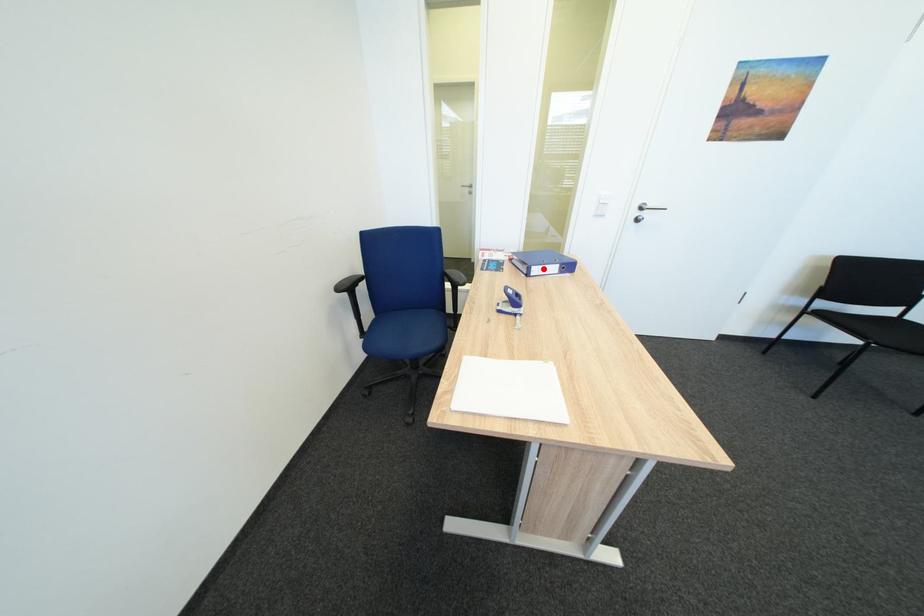
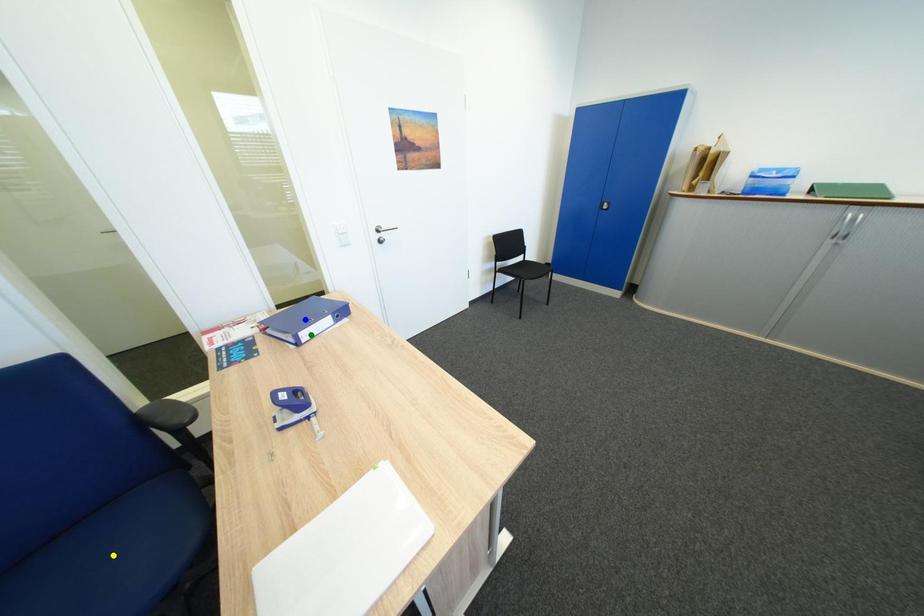
Question: I am providing you with two images of the same scene from different viewpoints. A red point is marked on the first image. You are given multiple points on the second image. Which spot in image 2 lines up with the point in image 1?

Choices:
 (A) green point
 (B) yellow point
 (C) blue point

Answer: (A)